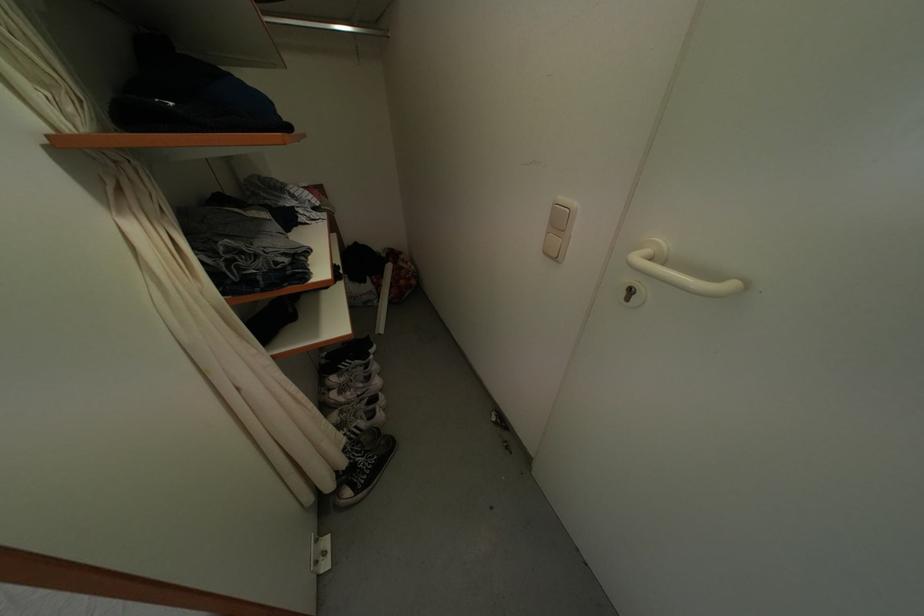
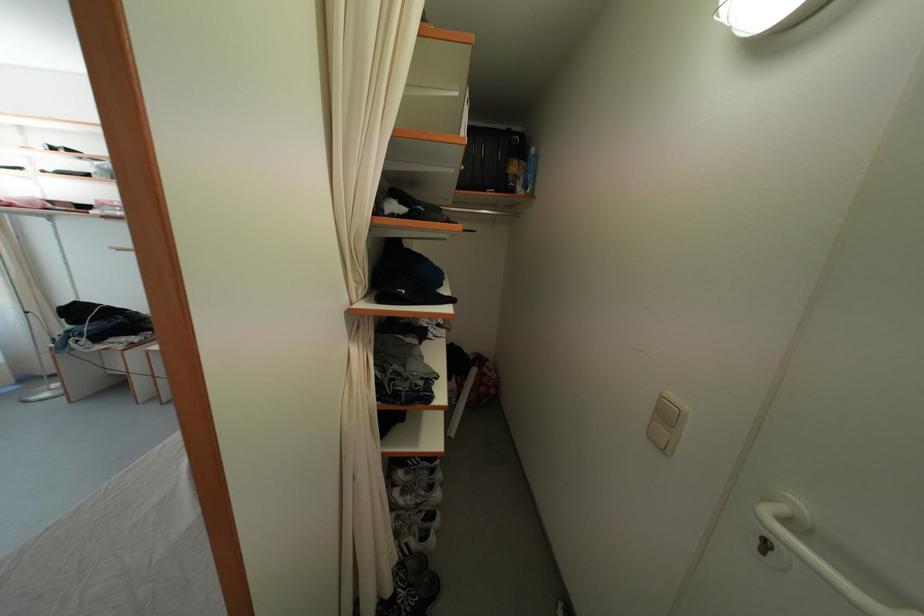
Based on the continuous images, in which direction is the camera rotating?

The camera rotated toward left-up.